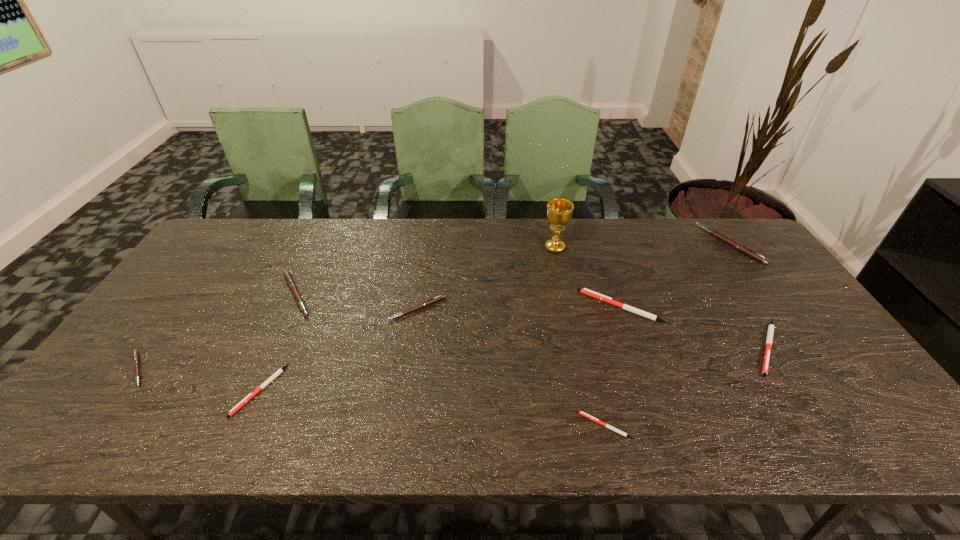
The width and height of the screenshot is (960, 540). I want to click on object that is at the left edge, so click(x=135, y=352).

Locate an element on the screen. The height and width of the screenshot is (540, 960). object that is at the far right corner is located at coordinates (743, 249).

In the image, there is a desktop. At what (x,y) coordinates should I click in order to perform the action: click on vacant space at the far edge. Please return your answer as a coordinate pair (x, y). The height and width of the screenshot is (540, 960). Looking at the image, I should click on (652, 253).

In the image, there is a desktop. Where is `vacant area at the near edge`? This screenshot has height=540, width=960. vacant area at the near edge is located at coordinates (648, 419).

In the image, there is a desktop. Where is `vacant space at the left edge`? vacant space at the left edge is located at coordinates (221, 278).

Locate an element on the screen. This screenshot has width=960, height=540. vacant space at the right edge of the desktop is located at coordinates (796, 382).

The height and width of the screenshot is (540, 960). In order to click on free space at the far right corner in this screenshot , I will do `click(723, 254)`.

What are the coordinates of `blank space at the near right corner` in the screenshot? It's located at (823, 417).

This screenshot has height=540, width=960. In order to click on unoccupied area between the leftmost white pen and the shortest pen in this screenshot , I will do `click(432, 408)`.

Find the location of `free spot between the second smallest pink pen and the leftmost pink pen`. free spot between the second smallest pink pen and the leftmost pink pen is located at coordinates (277, 339).